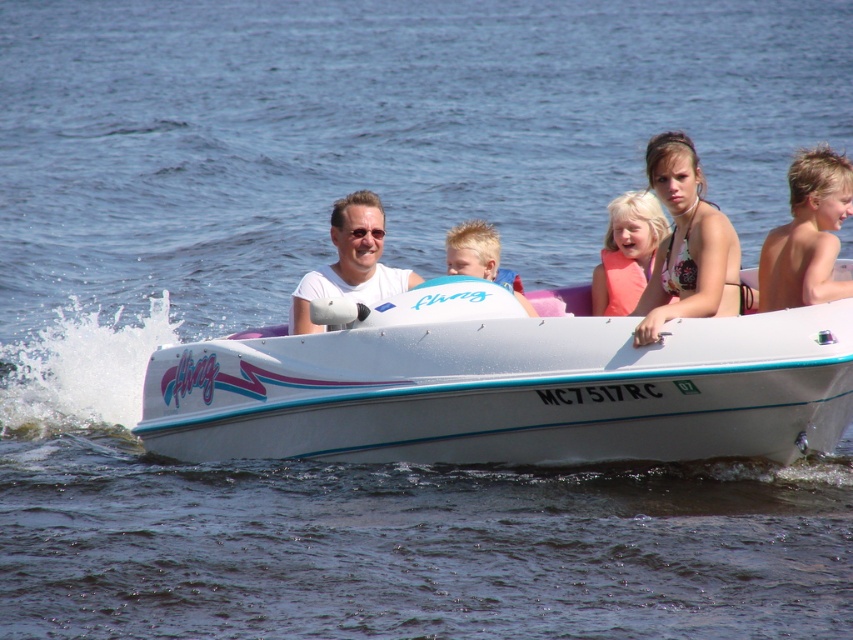
Question: Can you confirm if white plastic boat at center is positioned below blonde hair at upper right?

Choices:
 (A) no
 (B) yes

Answer: (B)

Question: Does white plastic boat at center appear on the left side of blonde hair at center?

Choices:
 (A) no
 (B) yes

Answer: (A)

Question: Which of the following is the closest to the observer?

Choices:
 (A) matte pink bikini top at upper center
 (B) white plastic boat at center
 (C) blonde hair at upper right

Answer: (A)

Question: Can you confirm if white plastic boat at center is smaller than matte white shirt at center?

Choices:
 (A) yes
 (B) no

Answer: (A)

Question: Among these points, which one is farthest from the camera?

Choices:
 (A) (751, 298)
 (B) (250, 360)

Answer: (A)

Question: Which object is positioned closest to the white plastic boat at center?

Choices:
 (A) matte pink life vest at center
 (B) matte pink bikini top at upper center
 (C) blonde hair at center
 (D) matte white shirt at center

Answer: (B)